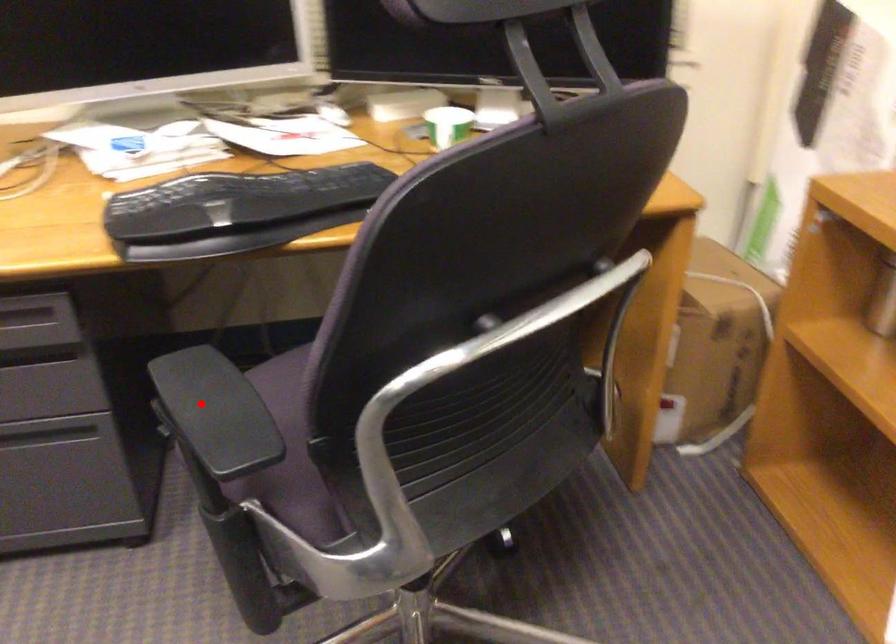
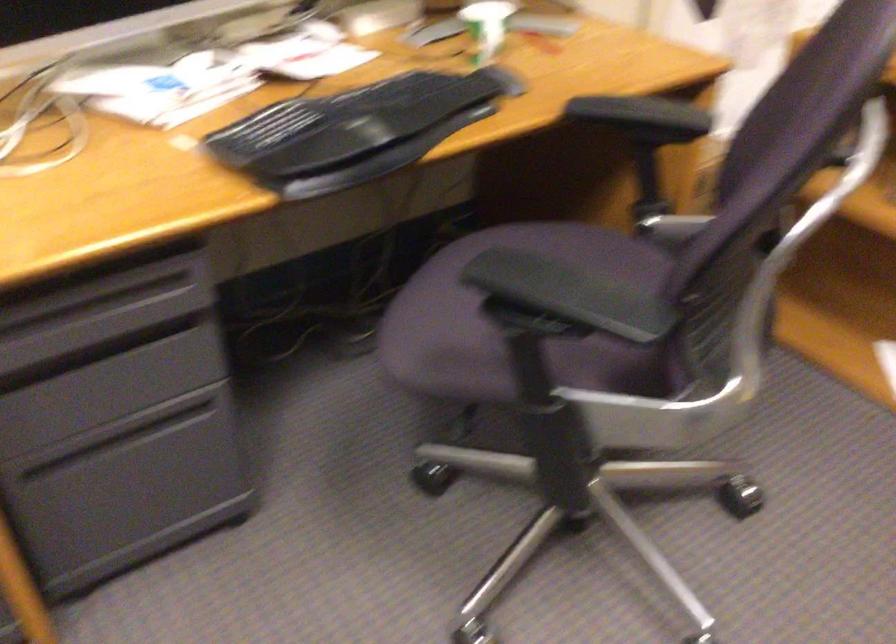
Find the pixel in the second image that matches the highlighted location in the first image.

(564, 289)